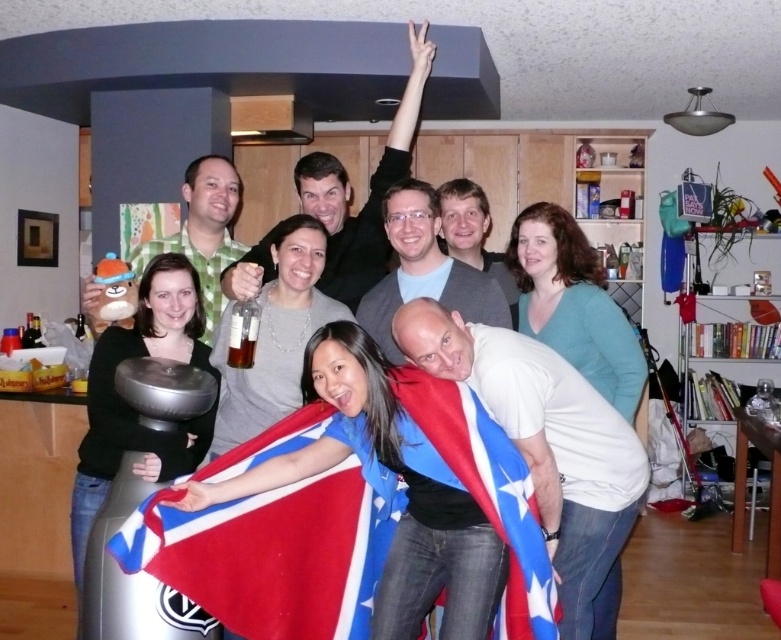
Between point (455, 467) and point (291, 388), which one is positioned in front?

Positioned in front is point (455, 467).

Is point (464, 403) more distant than point (264, 381)?

No, it is not.

You are a GUI agent. You are given a task and a screenshot of the screen. Output one action in this format:
    pyautogui.click(x=<x>, y=<y>)
    Task: Click on the red fabric flag at center
    
    Given the screenshot: What is the action you would take?
    pyautogui.click(x=484, y=492)

Does red fabric flag at center appear under translucent glass bottle at center?

Yes, red fabric flag at center is below translucent glass bottle at center.

Which is above, red fabric flag at center or translucent glass bottle at center?

translucent glass bottle at center is higher up.

Is point (533, 547) closer to camera compared to point (234, 360)?

That is True.

I want to click on red fabric flag at center, so click(x=484, y=492).

Measure the distance between matte gray sweater at center and camera.

2.23 meters

Can you confirm if matte gray sweater at center is wider than translucent glass bottle at center?

Correct, the width of matte gray sweater at center exceeds that of translucent glass bottle at center.

The height and width of the screenshot is (640, 781). In order to click on matte gray sweater at center in this screenshot , I will do `click(273, 337)`.

Find the location of `matte gray sweater at center`. matte gray sweater at center is located at coordinates (273, 337).